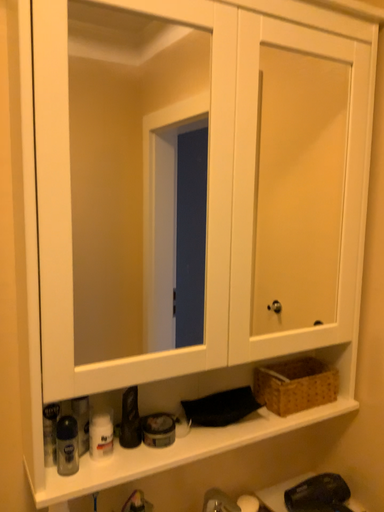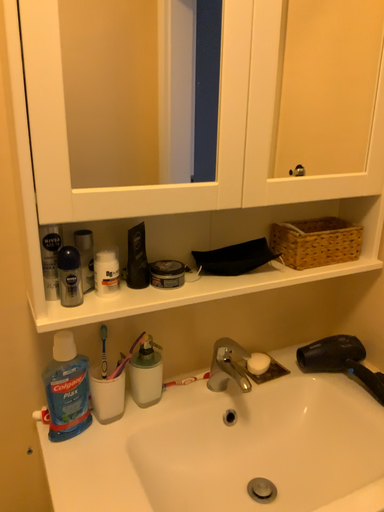
Question: Which way did the camera rotate in the video?

Choices:
 (A) rotated downward
 (B) rotated upward

Answer: (A)